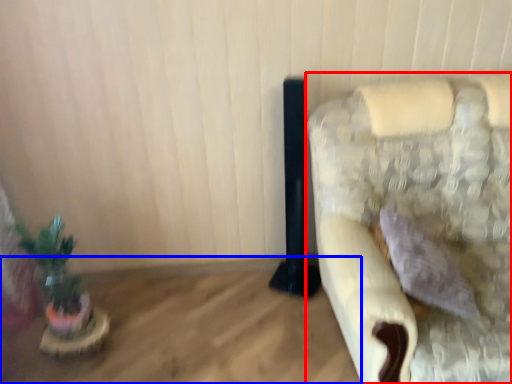
Question: Which object is further to the camera taking this photo, furniture (highlighted by a red box) or table (highlighted by a blue box)?

Choices:
 (A) furniture
 (B) table

Answer: (B)